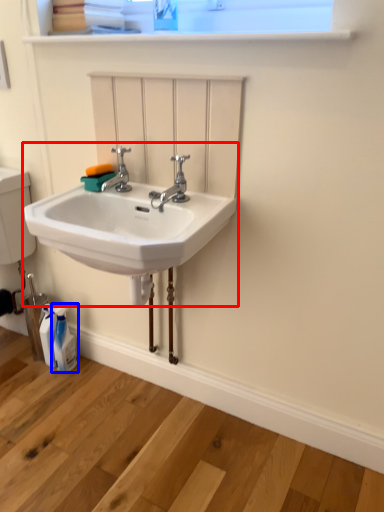
Question: Which point is closer to the camera, sink (highlighted by a red box) or toiletry (highlighted by a blue box)?

Choices:
 (A) sink
 (B) toiletry

Answer: (A)